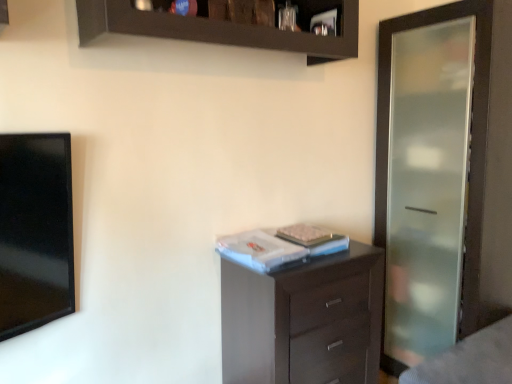
Describe the element at coordinates (423, 184) in the screenshot. The image size is (512, 384). I see `frosted glass screen door at right` at that location.

This screenshot has width=512, height=384. In order to click on dark wood shelf at upper center in this screenshot , I will do `click(225, 27)`.

Looking at their sizes, would you say dark wood chest of drawers at center is wider or thinner than dark wood shelf at upper center?

In the image, dark wood chest of drawers at center appears to be wider than dark wood shelf at upper center.

The height and width of the screenshot is (384, 512). I want to click on cupboard that is on the left side of dark wood chest of drawers at center, so (x=225, y=27).

Considering the sizes of objects dark wood chest of drawers at center and dark wood shelf at upper center in the image provided, who is shorter, dark wood chest of drawers at center or dark wood shelf at upper center?

dark wood shelf at upper center is shorter.

From the picture: What's the angular difference between dark wood chest of drawers at center and dark wood shelf at upper center's facing directions?

dark wood chest of drawers at center and dark wood shelf at upper center are facing 0.0015 degrees away from each other.

Is dark wood shelf at upper center positioned with its back to dark wood chest of drawers at center?

No, dark wood chest of drawers at center is not at the back of dark wood shelf at upper center.

From a real-world perspective, is dark wood shelf at upper center positioned over dark wood chest of drawers at center based on gravity?

Yes, from a real-world perspective, dark wood shelf at upper center is above dark wood chest of drawers at center.

Is point (343, 55) positioned behind point (298, 326)?

Yes, it is behind point (298, 326).

Based on the photo, in the image, is dark wood shelf at upper center positioned in front of or behind dark wood chest of drawers at center?

Clearly, dark wood shelf at upper center is in front of dark wood chest of drawers at center.

From the image's perspective, is dark wood shelf at upper center located above or below frosted glass screen door at right?

dark wood shelf at upper center is situated higher than frosted glass screen door at right in the image.

Is dark wood shelf at upper center behind frosted glass screen door at right?

No, dark wood shelf at upper center is closer to the camera.

How different are the orientations of dark wood shelf at upper center and frosted glass screen door at right in degrees?

The facing directions of dark wood shelf at upper center and frosted glass screen door at right are 90 degrees apart.

Is dark wood shelf at upper center taller than frosted glass screen door at right?

No, dark wood shelf at upper center is not taller than frosted glass screen door at right.

Considering the relative sizes of white matte book at center and dark wood chest of drawers at center in the image provided, is white matte book at center wider than dark wood chest of drawers at center?

In fact, white matte book at center might be narrower than dark wood chest of drawers at center.

Is dark wood chest of drawers at center surrounded by white matte book at center?

No, dark wood chest of drawers at center is not surrounded by white matte book at center.

From the image's perspective, does dark wood shelf at upper center appear lower than white matte book at center?

Incorrect, from the image's perspective, dark wood shelf at upper center is higher than white matte book at center.

From a real-world perspective, is dark wood shelf at upper center above or below white matte book at center?

From a real-world perspective, dark wood shelf at upper center is physically above white matte book at center.

Would you say dark wood shelf at upper center is outside white matte book at center?

dark wood shelf at upper center is positioned outside white matte book at center.

I want to click on book that is below the dark wood shelf at upper center (from the image's perspective), so click(280, 246).

Considering the relative positions of frosted glass screen door at right and dark wood shelf at upper center in the image provided, is frosted glass screen door at right behind dark wood shelf at upper center?

Yes, it is behind dark wood shelf at upper center.

The width and height of the screenshot is (512, 384). I want to click on screen door below the dark wood shelf at upper center (from the image's perspective), so click(x=423, y=184).

Considering the relative positions of frosted glass screen door at right and dark wood shelf at upper center in the image provided, is frosted glass screen door at right to the right of dark wood shelf at upper center from the viewer's perspective?

Indeed, frosted glass screen door at right is positioned on the right side of dark wood shelf at upper center.

Is frosted glass screen door at right wider than dark wood shelf at upper center?

Yes, frosted glass screen door at right is wider than dark wood shelf at upper center.

Who is smaller, frosted glass screen door at right or white matte book at center?

Smaller between the two is white matte book at center.

Which is less distant, (x=405, y=268) or (x=305, y=232)?

The point (x=305, y=232) is more forward.

Is frosted glass screen door at right oriented towards white matte book at center?

Yes, frosted glass screen door at right is turned towards white matte book at center.

Would you consider frosted glass screen door at right to be distant from white matte book at center?

frosted glass screen door at right is actually quite close to white matte book at center.

This screenshot has height=384, width=512. Identify the location of chest of drawers behind the dark wood shelf at upper center. [x=304, y=320].

Locate an element on the screen. cupboard that is above the dark wood chest of drawers at center (from the image's perspective) is located at coordinates (225, 27).

Based on the photo, considering their positions, is dark wood shelf at upper center positioned closer to frosted glass screen door at right than white matte book at center?

white matte book at center is closer to frosted glass screen door at right.

When comparing their distances from frosted glass screen door at right, does dark wood shelf at upper center or dark wood chest of drawers at center seem further?

dark wood shelf at upper center is further to frosted glass screen door at right.

Which object lies further to the anchor point frosted glass screen door at right, dark wood chest of drawers at center or dark wood shelf at upper center?

Based on the image, dark wood shelf at upper center appears to be further to frosted glass screen door at right.

Which object lies further to the anchor point white matte book at center, dark wood shelf at upper center or frosted glass screen door at right?

Based on the image, frosted glass screen door at right appears to be further to white matte book at center.

Looking at the image, which one is located closer to frosted glass screen door at right, white matte book at center or dark wood shelf at upper center?

Based on the image, white matte book at center appears to be nearer to frosted glass screen door at right.

Based on their spatial positions, is frosted glass screen door at right or white matte book at center further from dark wood chest of drawers at center?

Among the two, frosted glass screen door at right is located further to dark wood chest of drawers at center.

From the image, which object appears to be nearer to dark wood shelf at upper center, white matte book at center or frosted glass screen door at right?

The object closer to dark wood shelf at upper center is white matte book at center.

From the image, which object appears to be nearer to dark wood chest of drawers at center, dark wood shelf at upper center or white matte book at center?

white matte book at center is positioned closer to the anchor dark wood chest of drawers at center.

Locate an element on the screen. The width and height of the screenshot is (512, 384). screen door between dark wood shelf at upper center and dark wood chest of drawers at center in the up-down direction is located at coordinates (423, 184).

At what (x,y) coordinates should I click in order to perform the action: click on book between dark wood shelf at upper center and dark wood chest of drawers at center in the up-down direction. Please return your answer as a coordinate pair (x, y). Image resolution: width=512 pixels, height=384 pixels. Looking at the image, I should click on (280, 246).

Locate an element on the screen. The image size is (512, 384). book situated between dark wood shelf at upper center and frosted glass screen door at right from left to right is located at coordinates (280, 246).

I want to click on the chest of drawers located between white matte book at center and frosted glass screen door at right in the left-right direction, so click(304, 320).